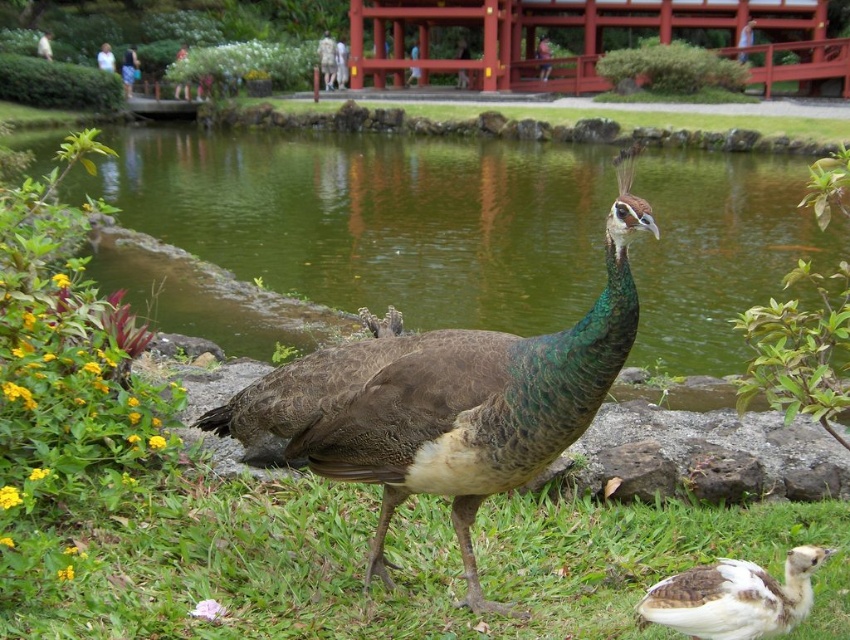
You are a small bird flying over the park and want to land near the green water at center and the white downy duckling at center. Which one is taller from your perspective?

The green water at center is taller than the white downy duckling at center.

You are a photographer standing in the park and want to take a picture of the green feathered peacock at center. However, the green water at center is blocking your view. Can you still see the peacock in your photo?

The green water at center is positioned over green feathered peacock at center, so the peacock is obscured by the water in the photo.